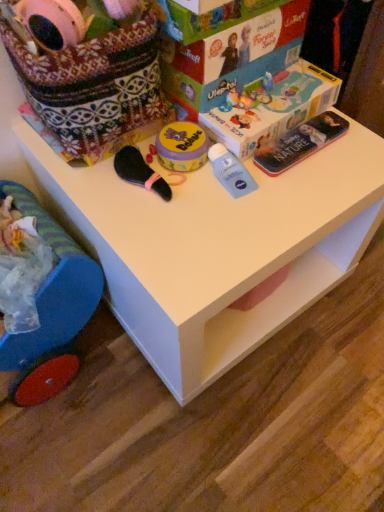
The height and width of the screenshot is (512, 384). I want to click on vacant space in front of matte plastic magazine at upper right, so click(297, 203).